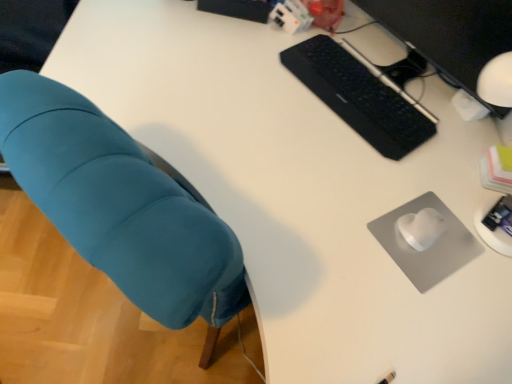
Identify the location of vacant space situated on the left part of black matte keyboard at upper right. tap(248, 81).